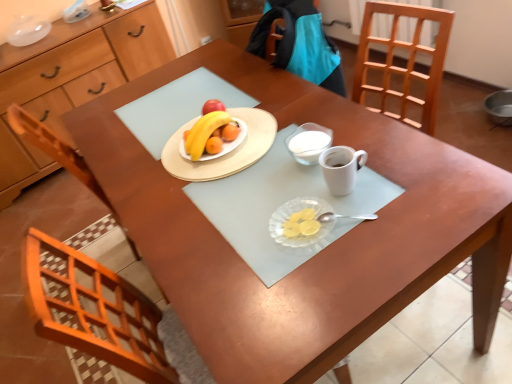
Identify the location of free space that is in between white glass bowl at center and yellow matte grapefruit at center. The width and height of the screenshot is (512, 384). (267, 154).